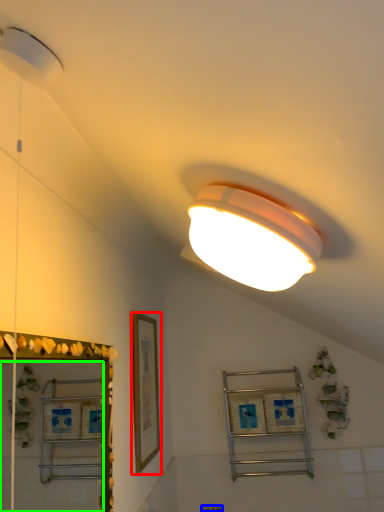
Question: Considering the real-world distances, which object is closest to picture frame (highlighted by a red box)? electric outlet (highlighted by a blue box) or mirror (highlighted by a green box).

Choices:
 (A) electric outlet
 (B) mirror

Answer: (B)